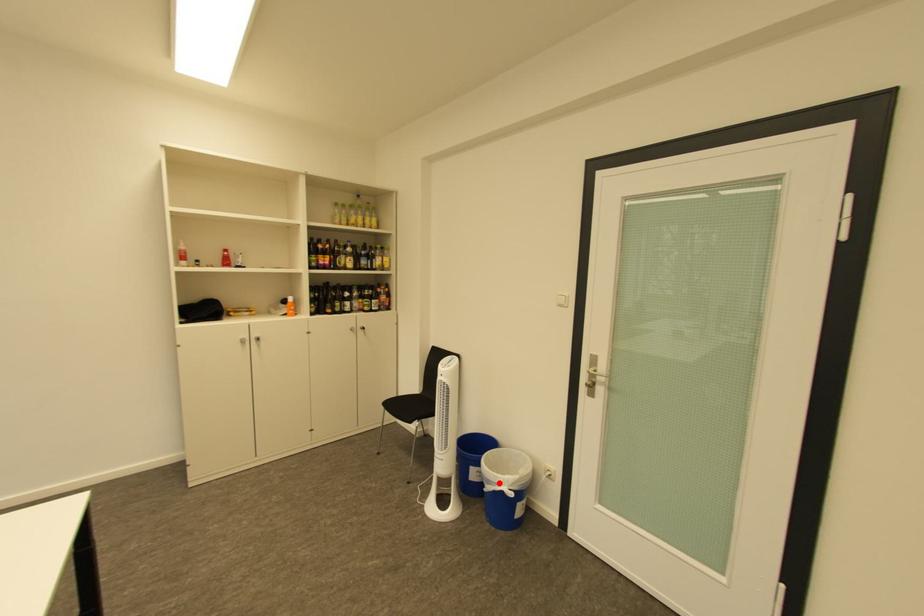
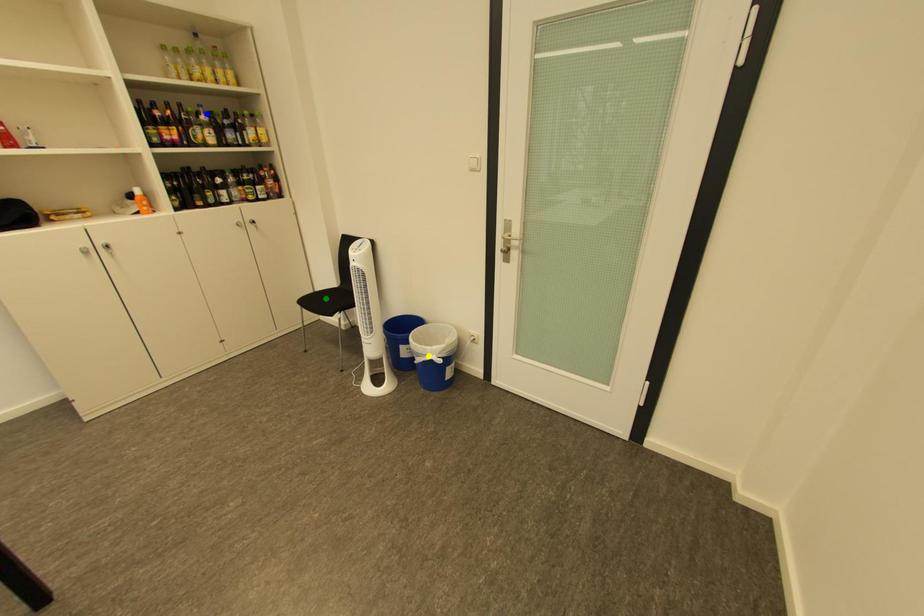
Question: I am providing you with two images of the same scene from different viewpoints. A red point is marked on the first image. You are given multiple points on the second image. Which mark in image 2 goes with the point in image 1?

Choices:
 (A) blue point
 (B) yellow point
 (C) green point

Answer: (B)